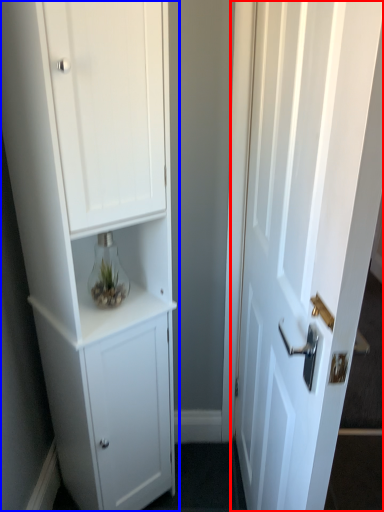
Question: Which object appears closest to the camera in this image, door (highlighted by a red box) or cupboard (highlighted by a blue box)?

Choices:
 (A) door
 (B) cupboard

Answer: (A)